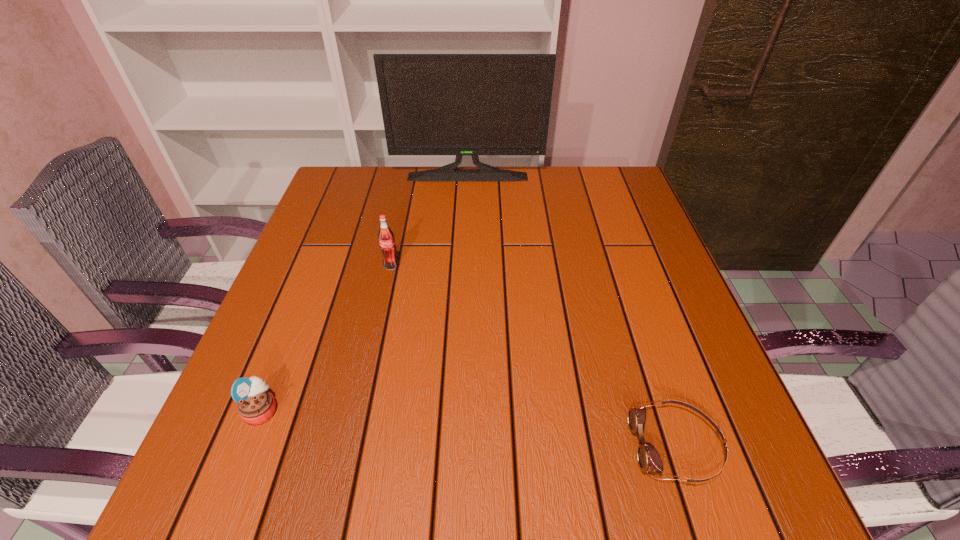
Where is `the tallest object`? The height and width of the screenshot is (540, 960). the tallest object is located at coordinates [x=432, y=104].

Image resolution: width=960 pixels, height=540 pixels. I want to click on the farthest object, so click(x=432, y=104).

Find the location of `the second farthest object`. the second farthest object is located at coordinates (386, 237).

You are a GUI agent. You are given a task and a screenshot of the screen. Output one action in this format:
    pyautogui.click(x=<x>, y=<y>)
    Task: Click on the soda bottle
    Image resolution: width=960 pixels, height=540 pixels.
    Given the screenshot: What is the action you would take?
    pyautogui.click(x=386, y=237)

Where is `muffin`? This screenshot has height=540, width=960. muffin is located at coordinates (256, 405).

This screenshot has width=960, height=540. I want to click on the leftmost object, so click(x=256, y=405).

Identify the location of the shortest object. (649, 459).

The height and width of the screenshot is (540, 960). I want to click on the rightmost object, so click(x=649, y=459).

Identify the location of free space located on the front-facing side of the farthest object. (464, 271).

This screenshot has width=960, height=540. Identify the location of blank space located 0.070m on the label of the soda bottle. (386, 292).